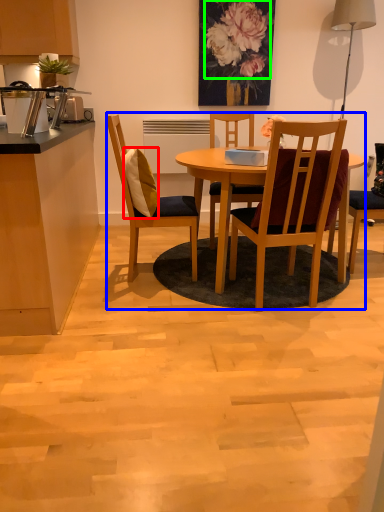
Question: Based on their relative distances, which object is farther from pillow (highlighted by a red box)? Choose from kitchen & dining room table (highlighted by a blue box) and flower (highlighted by a green box).

Choices:
 (A) kitchen & dining room table
 (B) flower

Answer: (B)